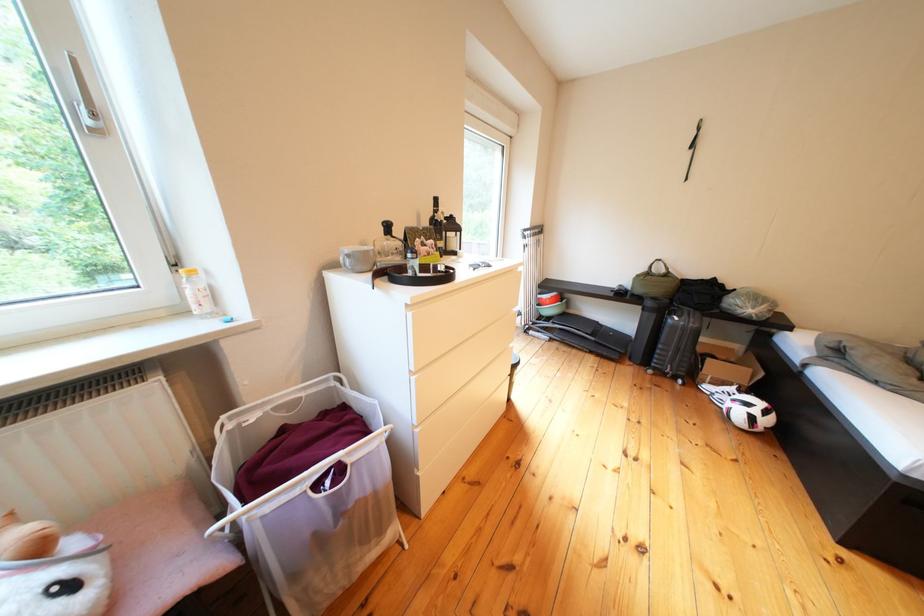
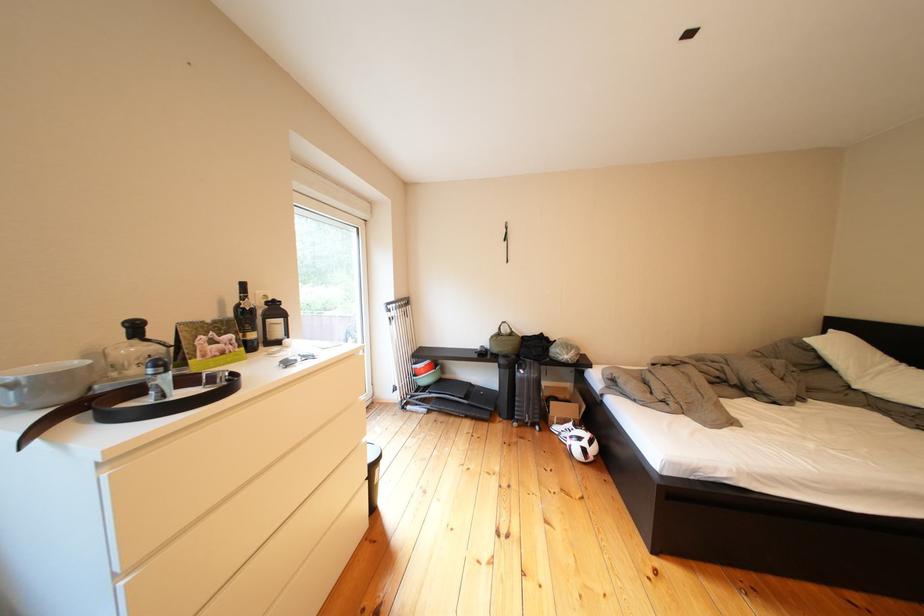
Find the pixel in the second image that matches pixel 396 227 in the first image.

(140, 328)